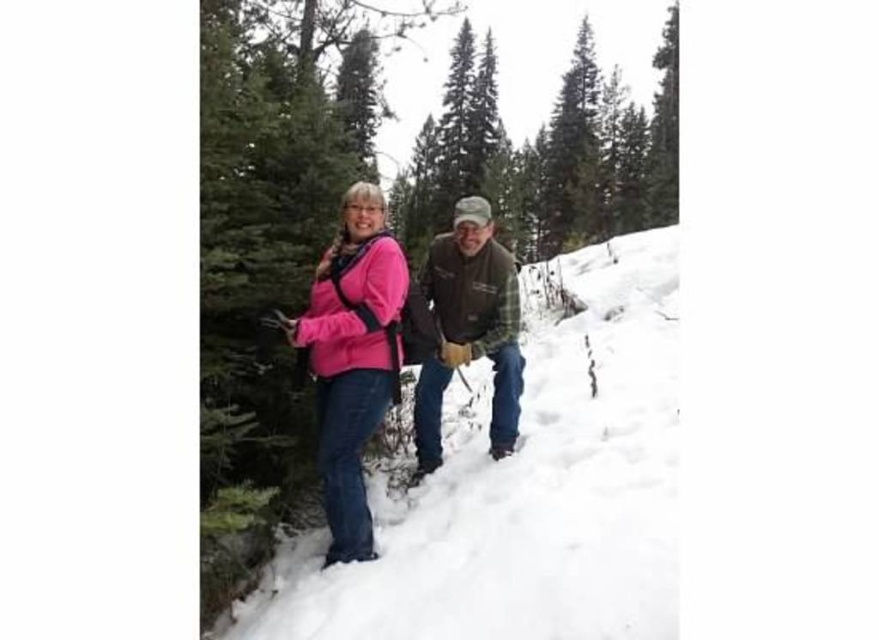
Does pink fleece jacket at center have a larger size compared to brown leather jacket at center?

Actually, pink fleece jacket at center might be smaller than brown leather jacket at center.

Does pink fleece jacket at center appear on the right side of brown leather jacket at center?

In fact, pink fleece jacket at center is to the left of brown leather jacket at center.

The height and width of the screenshot is (640, 879). I want to click on pink fleece jacket at center, so click(x=356, y=355).

Is white fluffy snow at center positioned at the back of pink fleece jacket at center?

No, white fluffy snow at center is in front of pink fleece jacket at center.

Does white fluffy snow at center have a lesser height compared to pink fleece jacket at center?

No.

Which is behind, point (623, 499) or point (352, 202)?

The point (352, 202) is more distant.

The image size is (879, 640). What are the coordinates of `white fluffy snow at center` in the screenshot? It's located at (527, 486).

Which of these two, white fluffy snow at center or brown leather jacket at center, stands shorter?

brown leather jacket at center

Between point (557, 557) and point (480, 246), which one is positioned in front?

Positioned in front is point (557, 557).

Image resolution: width=879 pixels, height=640 pixels. What are the coordinates of `white fluffy snow at center` in the screenshot? It's located at (527, 486).